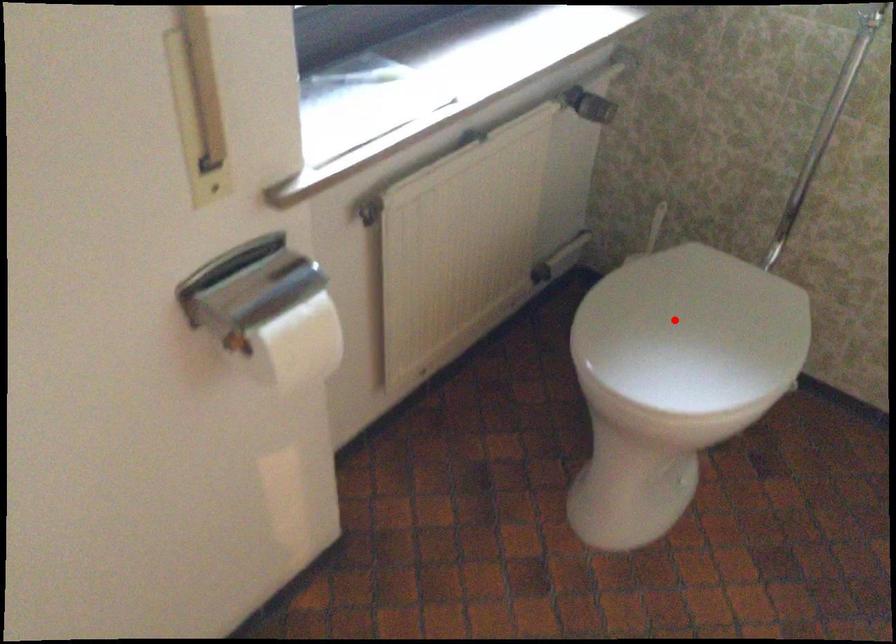
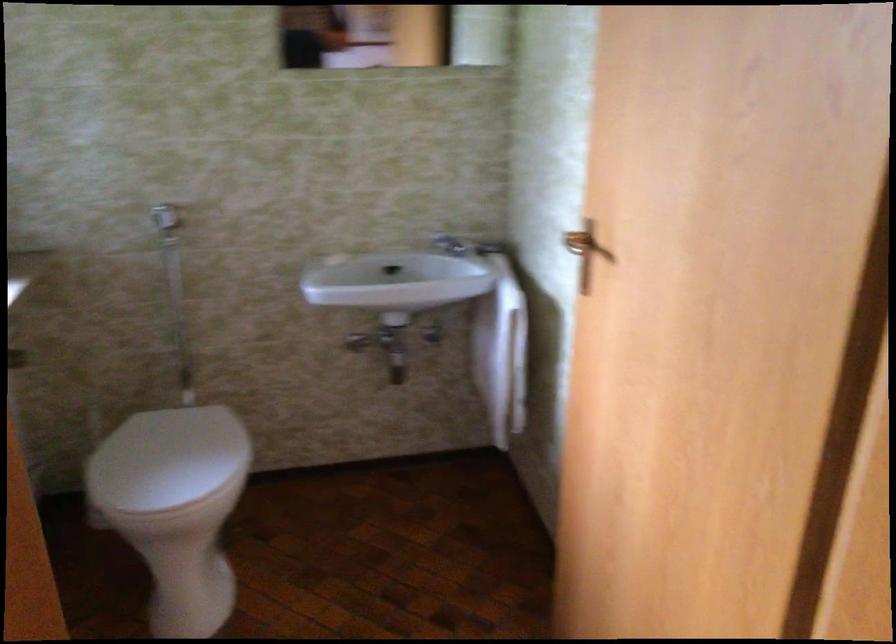
Question: I am providing you with two images of the same scene from different viewpoints. In image1, a red point is highlighted. Considering the same 3D point in image2, which of the following is correct?

Choices:
 (A) It is closer
 (B) It is farther

Answer: (B)